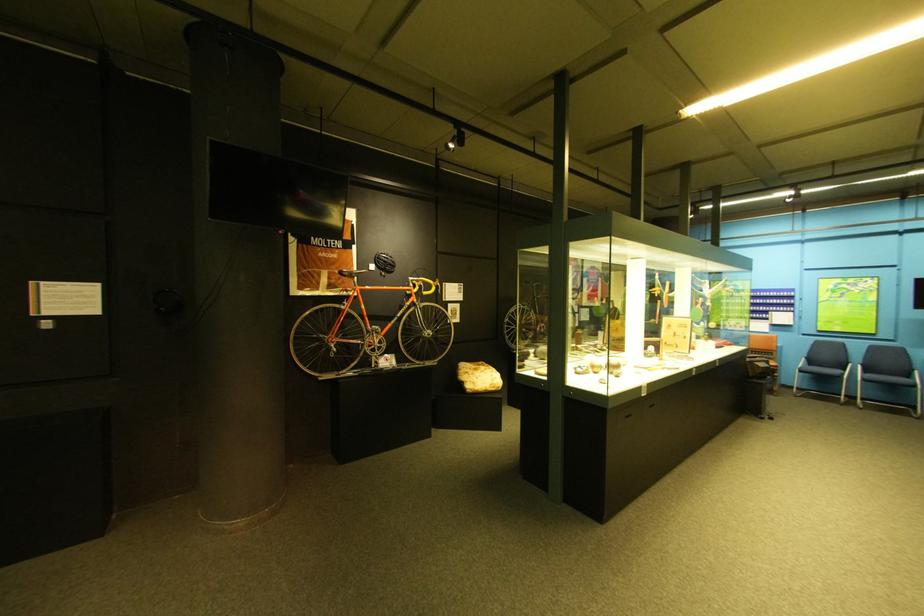
You are a GUI agent. You are given a task and a screenshot of the screen. Output one action in this format:
    pyautogui.click(x=<x>, y=<y>)
    Task: Click on the bicycle saddle
    This screenshot has height=616, width=924.
    Given the screenshot: What is the action you would take?
    pyautogui.click(x=354, y=272)